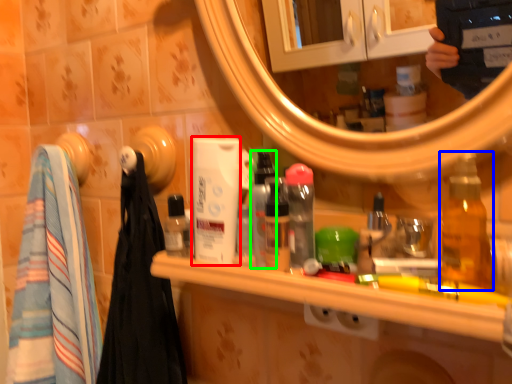
Question: Which object is positioned farthest from mouthwash (highlighted by a red box)? Select from bottle (highlighted by a blue box) and bottle (highlighted by a green box).

Choices:
 (A) bottle
 (B) bottle

Answer: (A)